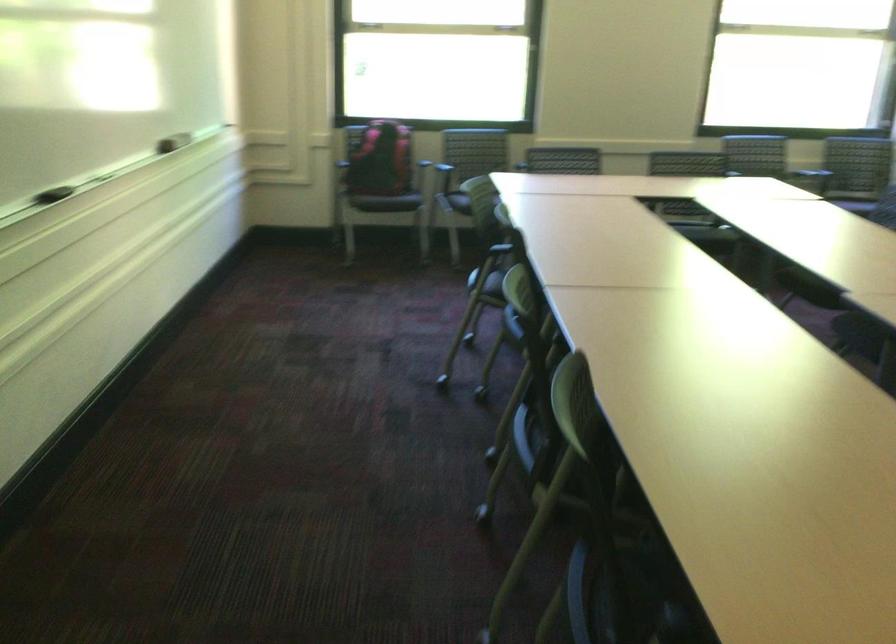
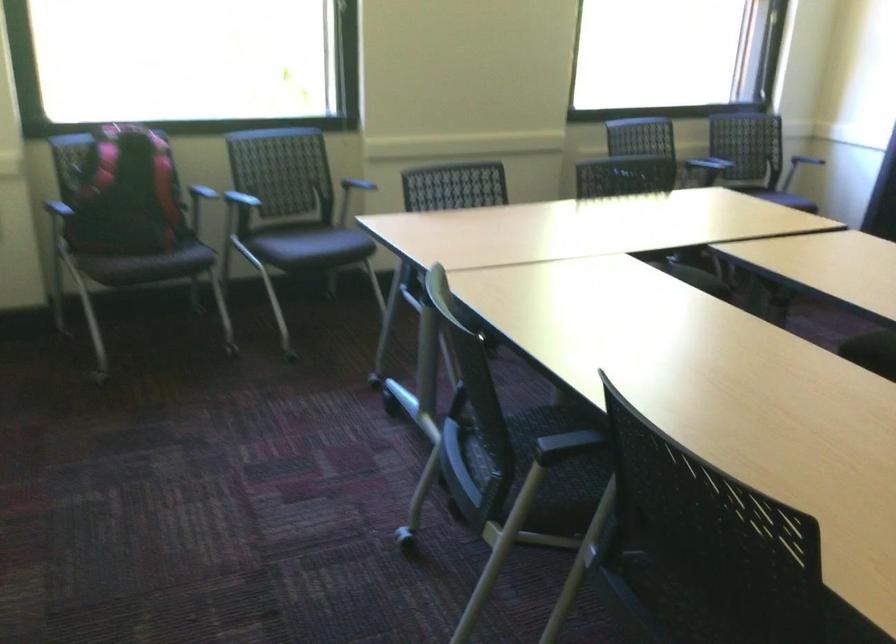
Locate, in the second image, the point that corresponds to pixel 420 147 in the first image.

(200, 183)